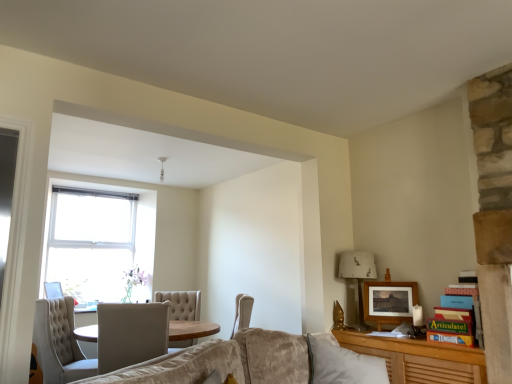
The width and height of the screenshot is (512, 384). What do you see at coordinates (53, 290) in the screenshot?
I see `wooden picture frame at lower left, positioned as the 1th picture frame in left-to-right order` at bounding box center [53, 290].

Describe the element at coordinates (131, 334) in the screenshot. I see `white tufted chair at center, marked as the 1th chair in a right-to-left arrangement` at that location.

The height and width of the screenshot is (384, 512). What do you see at coordinates (60, 343) in the screenshot?
I see `tufted fabric chair at lower left, the first chair from the left` at bounding box center [60, 343].

Describe the element at coordinates (358, 276) in the screenshot. The height and width of the screenshot is (384, 512). I see `white fabric lampshade at right` at that location.

Find the location of a particular element. white fabric lampshade at right is located at coordinates (358, 276).

You are a GUI agent. You are given a task and a screenshot of the screen. Output one action in this format:
    pyautogui.click(x=<x>, y=<y>)
    Task: Click on the wooden picture frame at lower left, positioned as the 1th picture frame in left-to-right order
    This screenshot has height=384, width=512.
    Given the screenshot: What is the action you would take?
    pyautogui.click(x=53, y=290)

From the image's perspective, is white tufted chair at center, which is counted as the second chair, starting from the left, above or below matte wooden picture frame at upper right, placed as the first picture frame when sorted from top to bottom?

From the image's perspective, white tufted chair at center, which is counted as the second chair, starting from the left, appears below matte wooden picture frame at upper right, placed as the first picture frame when sorted from top to bottom.

Which object is positioned more to the right, white tufted chair at center, marked as the 1th chair in a right-to-left arrangement, or matte wooden picture frame at upper right, which ranks as the 2th picture frame in back-to-front order?

From the viewer's perspective, matte wooden picture frame at upper right, which ranks as the 2th picture frame in back-to-front order, appears more on the right side.

Is white tufted chair at center, which is counted as the second chair, starting from the left, completely or partially outside of matte wooden picture frame at upper right, marked as the second picture frame in a left-to-right arrangement?

Yes, white tufted chair at center, which is counted as the second chair, starting from the left, is outside of matte wooden picture frame at upper right, marked as the second picture frame in a left-to-right arrangement.

Which object is further away from the camera, white tufted chair at center, which is counted as the second chair, starting from the left, or tufted fabric chair at lower left, the second chair viewed from the right?

tufted fabric chair at lower left, the second chair viewed from the right.

Is white tufted chair at center, which is counted as the second chair, starting from the left, wider than tufted fabric chair at lower left, the first chair from the left?

Correct, the width of white tufted chair at center, which is counted as the second chair, starting from the left, exceeds that of tufted fabric chair at lower left, the first chair from the left.

Is the surface of white tufted chair at center, marked as the 1th chair in a right-to-left arrangement, in direct contact with tufted fabric chair at lower left, the first chair from the left?

No, white tufted chair at center, marked as the 1th chair in a right-to-left arrangement, is not next to tufted fabric chair at lower left, the first chair from the left.

Which is more to the left, white tufted chair at center, marked as the 1th chair in a right-to-left arrangement, or tufted fabric chair at lower left, the first chair from the left?

Positioned to the left is tufted fabric chair at lower left, the first chair from the left.

Can we say white fabric lampshade at right lies outside wooden picture frame at lower left, marked as the second picture frame in a right-to-left arrangement?

Absolutely, white fabric lampshade at right is external to wooden picture frame at lower left, marked as the second picture frame in a right-to-left arrangement.

Is white fabric lampshade at right not near wooden picture frame at lower left, which ranks as the 2th picture frame in front-to-back order?

That's right, there is a large distance between white fabric lampshade at right and wooden picture frame at lower left, which ranks as the 2th picture frame in front-to-back order.

From the image's perspective, does white fabric lampshade at right appear lower than wooden picture frame at lower left, positioned as the 1th picture frame in left-to-right order?

No.

Is white tufted chair at center, which is counted as the second chair, starting from the left, turned away from white fabric lampshade at right?

white tufted chair at center, which is counted as the second chair, starting from the left, does not have its back to white fabric lampshade at right.

Considering the sizes of objects white tufted chair at center, which is counted as the second chair, starting from the left, and white fabric lampshade at right in the image provided, who is smaller, white tufted chair at center, which is counted as the second chair, starting from the left, or white fabric lampshade at right?

Smaller between the two is white fabric lampshade at right.

Is white tufted chair at center, which is counted as the second chair, starting from the left, not near white fabric lampshade at right?

Yes, white tufted chair at center, which is counted as the second chair, starting from the left, and white fabric lampshade at right are located far from each other.

The image size is (512, 384). I want to click on lamp that appears above the white tufted chair at center, marked as the 1th chair in a right-to-left arrangement (from a real-world perspective), so [358, 276].

From the image's perspective, is tufted fabric chair at lower left, the second chair viewed from the right, above or below wooden picture frame at lower left, marked as the second picture frame in a right-to-left arrangement?

From the image's perspective, tufted fabric chair at lower left, the second chair viewed from the right, appears below wooden picture frame at lower left, marked as the second picture frame in a right-to-left arrangement.

From a real-world perspective, who is located lower, tufted fabric chair at lower left, the second chair viewed from the right, or wooden picture frame at lower left, marked as the second picture frame in a right-to-left arrangement?

tufted fabric chair at lower left, the second chair viewed from the right.

Is tufted fabric chair at lower left, the first chair from the left, positioned with its back to wooden picture frame at lower left, positioned as the 1th picture frame in left-to-right order?

No, wooden picture frame at lower left, positioned as the 1th picture frame in left-to-right order, is not at the back of tufted fabric chair at lower left, the first chair from the left.

Could you tell me if matte wooden picture frame at upper right, which ranks as the 2th picture frame in back-to-front order, is turned towards wooden picture frame at lower left, the second picture frame in the top-to-bottom sequence?

No, matte wooden picture frame at upper right, which ranks as the 2th picture frame in back-to-front order, is not turned towards wooden picture frame at lower left, the second picture frame in the top-to-bottom sequence.

Is matte wooden picture frame at upper right, marked as the second picture frame in a left-to-right arrangement, not near wooden picture frame at lower left, which ranks as the 2th picture frame in front-to-back order?

Absolutely, matte wooden picture frame at upper right, marked as the second picture frame in a left-to-right arrangement, is distant from wooden picture frame at lower left, which ranks as the 2th picture frame in front-to-back order.

Image resolution: width=512 pixels, height=384 pixels. In order to click on picture frame behind the matte wooden picture frame at upper right, which is the 1th picture frame in right-to-left order in this screenshot , I will do `click(53, 290)`.

Do you think matte wooden picture frame at upper right, which ranks as the 2th picture frame in back-to-front order, is within wooden picture frame at lower left, positioned as the 1th picture frame in left-to-right order, or outside of it?

matte wooden picture frame at upper right, which ranks as the 2th picture frame in back-to-front order, cannot be found inside wooden picture frame at lower left, positioned as the 1th picture frame in left-to-right order.

Would you say matte wooden picture frame at upper right, which is the 1th picture frame in right-to-left order, contains tufted fabric chair at lower left, the first chair from the left?

No, tufted fabric chair at lower left, the first chair from the left, is not a part of matte wooden picture frame at upper right, which is the 1th picture frame in right-to-left order.

From a real-world perspective, is matte wooden picture frame at upper right, placed as the first picture frame when sorted from top to bottom, physically located above or below tufted fabric chair at lower left, the first chair from the left?

matte wooden picture frame at upper right, placed as the first picture frame when sorted from top to bottom, is above tufted fabric chair at lower left, the first chair from the left.

Who is bigger, matte wooden picture frame at upper right, which ranks as the 2th picture frame in back-to-front order, or tufted fabric chair at lower left, the second chair viewed from the right?

tufted fabric chair at lower left, the second chair viewed from the right.

Are matte wooden picture frame at upper right, which is the first picture frame in front-to-back order, and tufted fabric chair at lower left, the second chair viewed from the right, located far from each other?

matte wooden picture frame at upper right, which is the first picture frame in front-to-back order, is far away from tufted fabric chair at lower left, the second chair viewed from the right.

At what (x,y) coordinates should I click in order to perform the action: click on the 1st chair to the left of the matte wooden picture frame at upper right, marked as the second picture frame in a left-to-right arrangement, starting your count from the anchor. Please return your answer as a coordinate pair (x, y). Looking at the image, I should click on (131, 334).

In order to click on chair lying on the right of tufted fabric chair at lower left, the second chair viewed from the right in this screenshot , I will do `click(131, 334)`.

Based on their spatial positions, is wooden picture frame at lower left, which ranks as the 2th picture frame in front-to-back order, or tufted fabric chair at lower left, the first chair from the left, closer to matte wooden picture frame at upper right, marked as the second picture frame in a left-to-right arrangement?

The object closer to matte wooden picture frame at upper right, marked as the second picture frame in a left-to-right arrangement, is tufted fabric chair at lower left, the first chair from the left.

From the image, which object appears to be farther from wooden picture frame at lower left, which ranks as the 2th picture frame in front-to-back order, white tufted chair at center, marked as the 1th chair in a right-to-left arrangement, or white fabric lampshade at right?

Based on the image, white fabric lampshade at right appears to be further to wooden picture frame at lower left, which ranks as the 2th picture frame in front-to-back order.

Based on their spatial positions, is matte wooden picture frame at upper right, which is the first picture frame in front-to-back order, or wooden picture frame at lower left, the first picture frame when ordered from back to front, closer to tufted fabric chair at lower left, the second chair viewed from the right?

wooden picture frame at lower left, the first picture frame when ordered from back to front, is closer to tufted fabric chair at lower left, the second chair viewed from the right.

Considering their positions, is tufted fabric chair at lower left, the first chair from the left, positioned closer to white fabric lampshade at right than wooden picture frame at lower left, marked as the second picture frame in a right-to-left arrangement?

The object closer to white fabric lampshade at right is tufted fabric chair at lower left, the first chair from the left.

From the image, which object appears to be farther from matte wooden picture frame at upper right, which is the 1th picture frame in right-to-left order, white tufted chair at center, marked as the 1th chair in a right-to-left arrangement, or white fabric lampshade at right?

Among the two, white tufted chair at center, marked as the 1th chair in a right-to-left arrangement, is located further to matte wooden picture frame at upper right, which is the 1th picture frame in right-to-left order.

Looking at this image, which object lies further to the anchor point wooden picture frame at lower left, which ranks as the 2th picture frame in front-to-back order, matte wooden picture frame at upper right, placed as the first picture frame when sorted from top to bottom, or tufted fabric chair at lower left, the first chair from the left?

matte wooden picture frame at upper right, placed as the first picture frame when sorted from top to bottom, lies further to wooden picture frame at lower left, which ranks as the 2th picture frame in front-to-back order, than the other object.

Looking at this image, when comparing their distances from matte wooden picture frame at upper right, marked as the second picture frame in a left-to-right arrangement, does white fabric lampshade at right or white tufted chair at center, marked as the 1th chair in a right-to-left arrangement, seem further?

The object further to matte wooden picture frame at upper right, marked as the second picture frame in a left-to-right arrangement, is white tufted chair at center, marked as the 1th chair in a right-to-left arrangement.

From the picture: From the image, which object appears to be farther from wooden picture frame at lower left, the 1th picture frame from the bottom, white tufted chair at center, which is counted as the second chair, starting from the left, or tufted fabric chair at lower left, the second chair viewed from the right?

The object further to wooden picture frame at lower left, the 1th picture frame from the bottom, is white tufted chair at center, which is counted as the second chair, starting from the left.

Find the location of a particular element. Image resolution: width=512 pixels, height=384 pixels. lamp located between wooden picture frame at lower left, which ranks as the 2th picture frame in front-to-back order, and matte wooden picture frame at upper right, marked as the second picture frame in a left-to-right arrangement, in the left-right direction is located at coordinates (358, 276).

Where is `chair between white tufted chair at center, marked as the 1th chair in a right-to-left arrangement, and wooden picture frame at lower left, which ranks as the 2th picture frame in front-to-back order, along the z-axis`? chair between white tufted chair at center, marked as the 1th chair in a right-to-left arrangement, and wooden picture frame at lower left, which ranks as the 2th picture frame in front-to-back order, along the z-axis is located at coordinates (60, 343).

Locate an element on the screen. Image resolution: width=512 pixels, height=384 pixels. lamp between tufted fabric chair at lower left, the first chair from the left, and matte wooden picture frame at upper right, marked as the second picture frame in a left-to-right arrangement is located at coordinates (358, 276).

Image resolution: width=512 pixels, height=384 pixels. What are the coordinates of `chair situated between tufted fabric chair at lower left, the first chair from the left, and matte wooden picture frame at upper right, placed as the first picture frame when sorted from top to bottom, from left to right` in the screenshot? It's located at (131, 334).